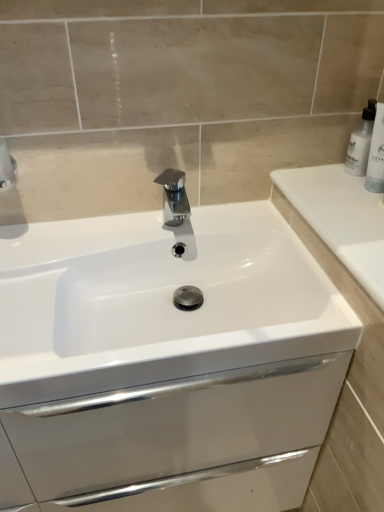
At what (x,y) coordinates should I click in order to perform the action: click on free space to the left of polished chrome tap at center. Please return your answer as a coordinate pair (x, y). This screenshot has width=384, height=512. Looking at the image, I should click on (113, 234).